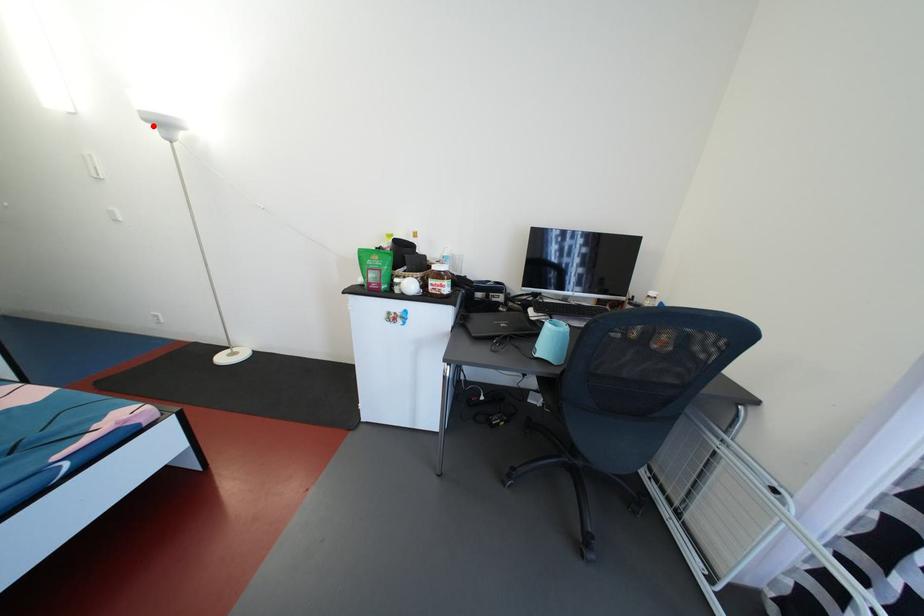
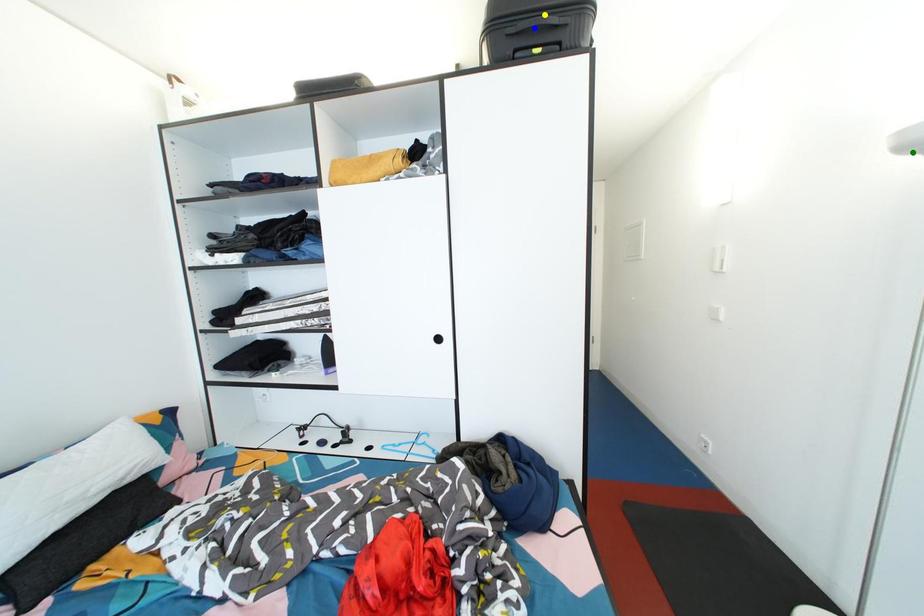
Question: I am providing you with two images of the same scene from different viewpoints. A red point is marked on the first image. You are given multiple points on the second image. Can you choose the point in image 2 that corresponds to the point in image 1?

Choices:
 (A) yellow point
 (B) green point
 (C) blue point

Answer: (B)